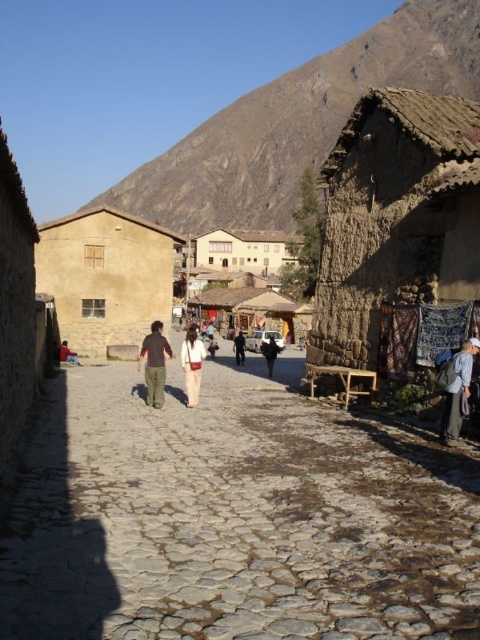
Question: Which point is farther to the camera?

Choices:
 (A) (164, 257)
 (B) (233, 340)

Answer: (B)

Question: Is beige stucco hut at center positioned behind light beige cotton pants at center?

Choices:
 (A) yes
 (B) no

Answer: (A)

Question: Is blue cotton shirt at right above black leather jacket at center?

Choices:
 (A) yes
 (B) no

Answer: (A)

Question: Which point appears closest to the camera in this image?

Choices:
 (A) (437, 272)
 (B) (202, 214)

Answer: (A)

Question: Is brown cobblestone path at center thinner than brown rocky mountain at upper center?

Choices:
 (A) yes
 (B) no

Answer: (A)

Question: Which object is closer to the camera taking this photo?

Choices:
 (A) blue cotton shirt at right
 (B) beige stucco hut at center

Answer: (A)